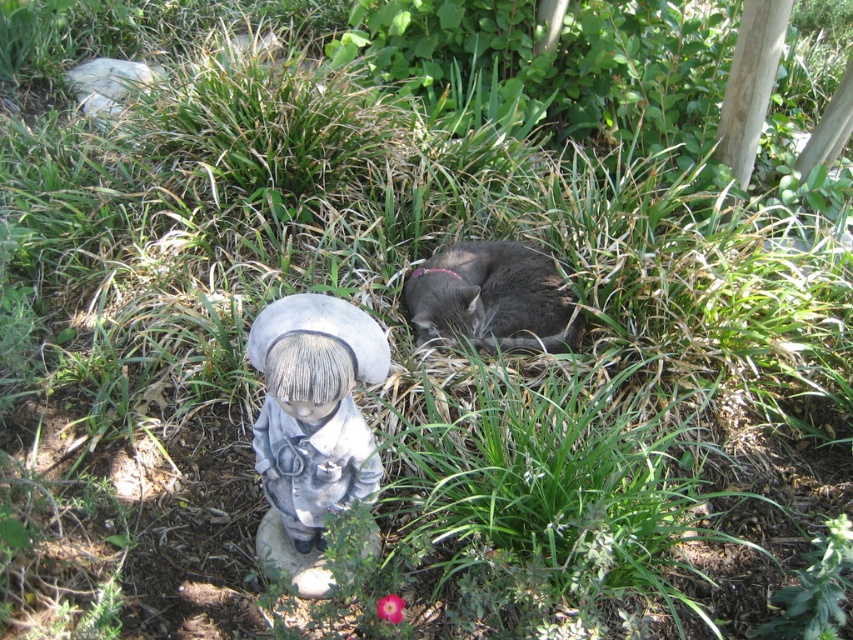
You are a painter setting up an easel to sketch the gray stone figurine at lower left and the gray fur cat at center. You want to ensure your painting accurately reflects their sizes. Which object should you draw larger in your sketch?

The gray fur cat at center should be drawn larger in the sketch because the gray stone figurine at lower left is narrower than the gray fur cat at center.